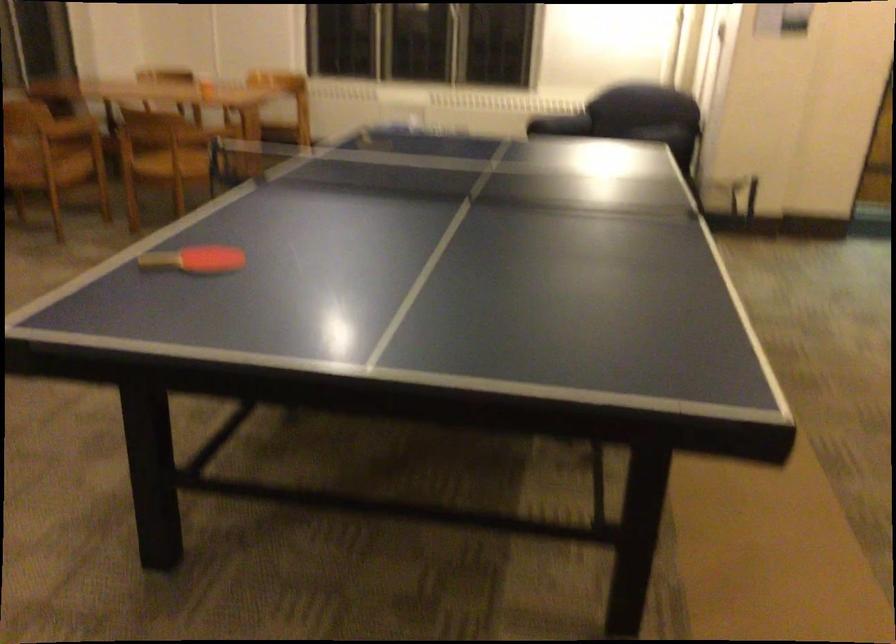
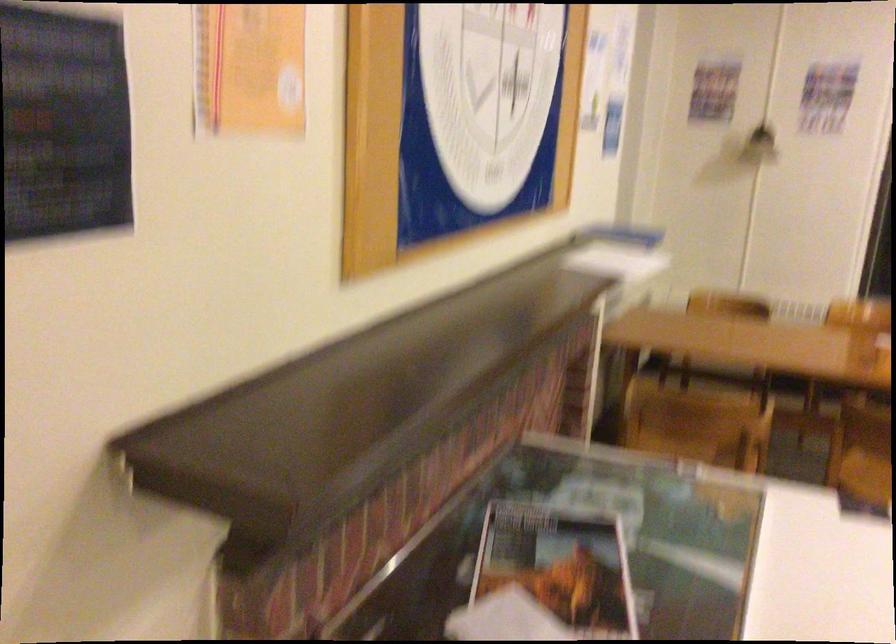
In a continuous first-person perspective shot, in which direction is the camera moving?

The cameraman walked toward left, forward.